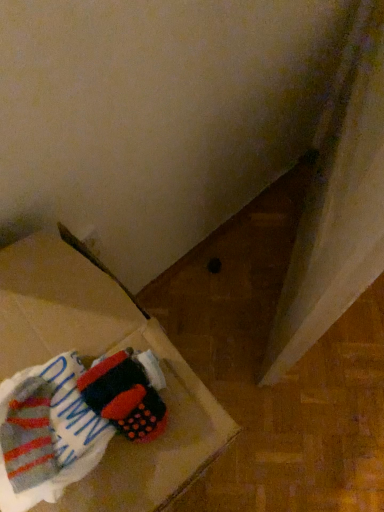
Question: From a real-world perspective, is striped cotton socks at lower left positioned under white fabric at lower left based on gravity?

Choices:
 (A) yes
 (B) no

Answer: (B)

Question: From the image's perspective, is striped cotton socks at lower left above white fabric at lower left?

Choices:
 (A) yes
 (B) no

Answer: (A)

Question: From a real-world perspective, is striped cotton socks at lower left over white fabric at lower left?

Choices:
 (A) no
 (B) yes

Answer: (B)

Question: Is striped cotton socks at lower left bigger than white fabric at lower left?

Choices:
 (A) yes
 (B) no

Answer: (B)

Question: Is striped cotton socks at lower left closer to the viewer compared to white fabric at lower left?

Choices:
 (A) no
 (B) yes

Answer: (A)

Question: Is striped cotton socks at lower left at the left side of white fabric at lower left?

Choices:
 (A) no
 (B) yes

Answer: (A)

Question: From a real-world perspective, does white fabric at lower left sit lower than striped cotton socks at lower left?

Choices:
 (A) yes
 (B) no

Answer: (A)

Question: Is white fabric at lower left facing away from striped cotton socks at lower left?

Choices:
 (A) no
 (B) yes

Answer: (A)

Question: Is white fabric at lower left oriented towards striped cotton socks at lower left?

Choices:
 (A) yes
 (B) no

Answer: (B)

Question: From the image's perspective, would you say white fabric at lower left is shown under striped cotton socks at lower left?

Choices:
 (A) yes
 (B) no

Answer: (A)

Question: Does white fabric at lower left have a lesser width compared to striped cotton socks at lower left?

Choices:
 (A) no
 (B) yes

Answer: (A)

Question: Would you say white fabric at lower left is a long distance from striped cotton socks at lower left?

Choices:
 (A) no
 (B) yes

Answer: (A)

Question: Is point (132, 374) positioned closer to the camera than point (115, 287)?

Choices:
 (A) closer
 (B) farther

Answer: (A)